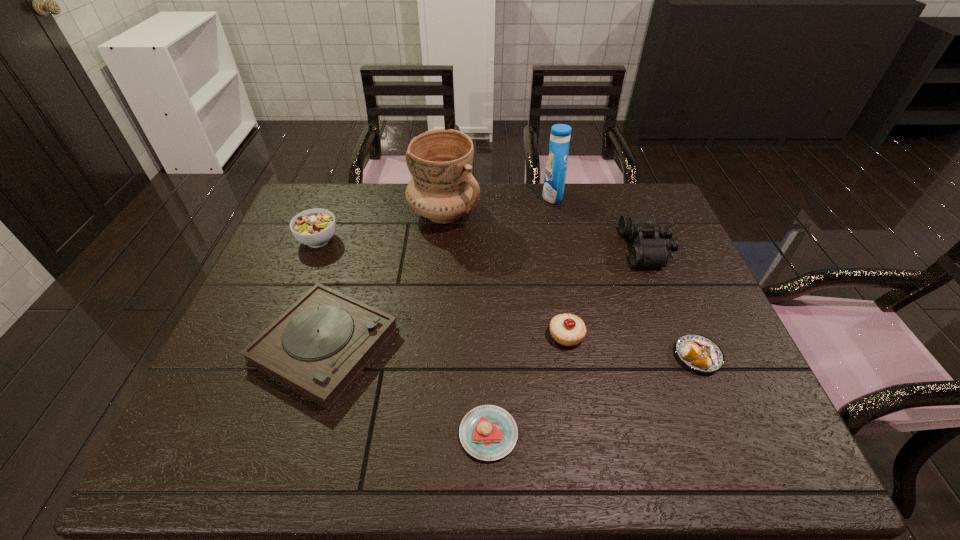
The image size is (960, 540). Find the location of `free point between the second pastry from right to left and the pottery`. free point between the second pastry from right to left and the pottery is located at coordinates (505, 274).

Where is `object that is the sixth closest to the tallest pastry`? object that is the sixth closest to the tallest pastry is located at coordinates (555, 174).

Choose which object is the seventh nearest neighbor to the pottery. Please provide its 2D coordinates. Your answer should be formatted as a tuple, i.e. [(x, y)], where the tuple contains the x and y coordinates of a point satisfying the conditions above.

[(697, 352)]

Identify which pastry is located as the third nearest to the binoculars. Please provide its 2D coordinates. Your answer should be formatted as a tuple, i.e. [(x, y)], where the tuple contains the x and y coordinates of a point satisfying the conditions above.

[(487, 432)]

I want to click on pastry that is the closest to the second pastry from left to right, so click(x=487, y=432).

This screenshot has width=960, height=540. Identify the location of vacant space that satisfies the following two spatial constraints: 1. at the eyepieces of the binoculars; 2. on the front side of the tallest pastry. (682, 335).

I want to click on vacant area in the image that satisfies the following two spatial constraints: 1. at the eyepieces of the binoculars; 2. on the left side of the rightmost pastry, so click(x=690, y=356).

Where is `blank area in the image that satisfies the following two spatial constraints: 1. at the eyepieces of the binoculars; 2. on the front side of the second pastry from right to left`? The width and height of the screenshot is (960, 540). blank area in the image that satisfies the following two spatial constraints: 1. at the eyepieces of the binoculars; 2. on the front side of the second pastry from right to left is located at coordinates (682, 335).

Identify the location of vacant point that satisfies the following two spatial constraints: 1. on the front-facing side of the detergent; 2. on the left side of the rightmost pastry. (585, 356).

The width and height of the screenshot is (960, 540). What are the coordinates of `blank space that satisfies the following two spatial constraints: 1. on the front-facing side of the detergent; 2. on the front side of the nearest pastry` in the screenshot? It's located at (600, 434).